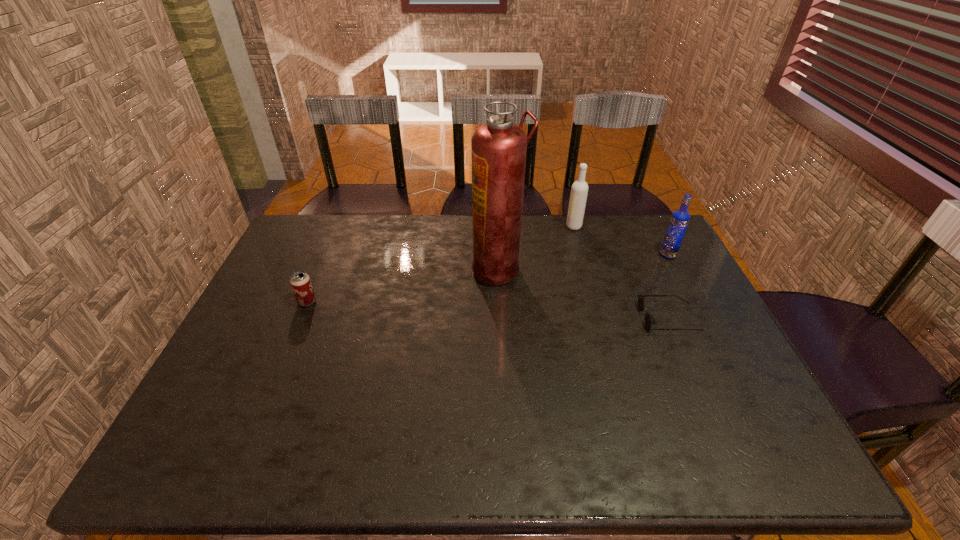
Find the location of a particular element. sunglasses that is at the right edge is located at coordinates (649, 319).

Find the location of `object present at the far right corner`. object present at the far right corner is located at coordinates (680, 218).

The width and height of the screenshot is (960, 540). What are the coordinates of `free space at the far edge of the desktop` in the screenshot? It's located at (563, 251).

In the image, there is a desktop. Find the location of `free space at the near edge`. free space at the near edge is located at coordinates (313, 462).

You are a GUI agent. You are given a task and a screenshot of the screen. Output one action in this format:
    pyautogui.click(x=<x>, y=<y>)
    Task: Click on the free space at the left edge
    
    Given the screenshot: What is the action you would take?
    pyautogui.click(x=252, y=342)

At what (x,y) coordinates should I click in order to perform the action: click on vacant region at the right edge of the desktop. Please return your answer as a coordinate pair (x, y). Looking at the image, I should click on (696, 404).

The image size is (960, 540). Identify the location of blank space at the far right corner of the desktop. (647, 252).

The height and width of the screenshot is (540, 960). What are the coordinates of `unoccupied area between the nearer vodka and the sunglasses` in the screenshot? It's located at (668, 287).

I want to click on vacant region between the left vodka and the right vodka, so click(621, 241).

Find the location of a particular element. vacant area that lies between the fire extinguisher and the sunglasses is located at coordinates (584, 294).